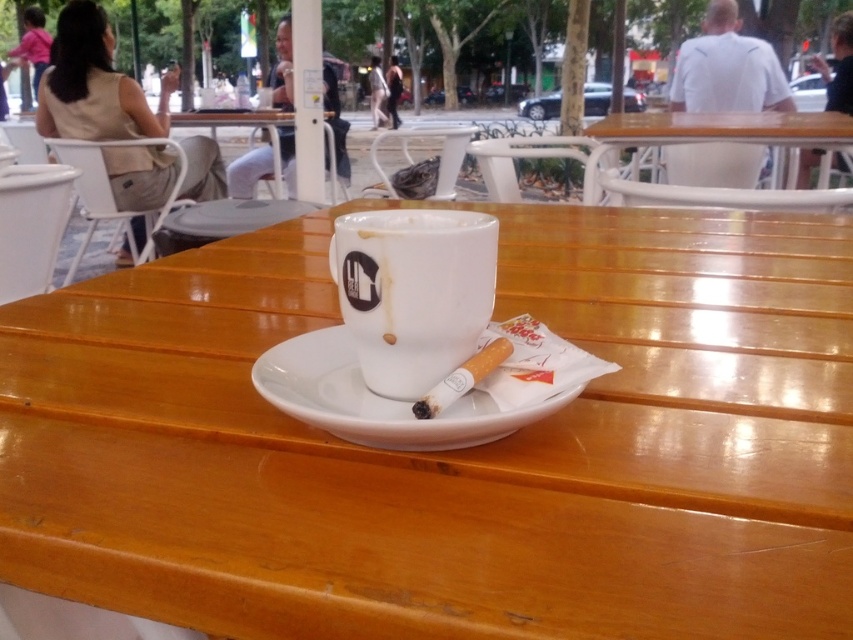
You are a photographer trying to capture the best shot of the outdoor cafe scene. You notice two specific points in the image at coordinates point (354, 276) and point (589, 182). Which of these points is positioned closer to the camera lens?

Point (354, 276) is closer to the camera than point (589, 182).

You are sitting at the wooden table at center and want to wave to a friend who is sitting at the wooden table at upper right. Since you can only wave your arm forward, can your friend see your wave?

The wooden table at center is in front of wooden table at upper right, so your friend at the wooden table at upper right will see your wave because you are facing the same direction and your arm movement will be visible.